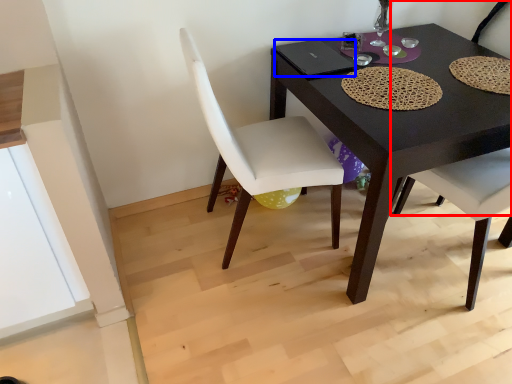
Question: Which point is further to the camera, chair (highlighted by a red box) or laptop (highlighted by a blue box)?

Choices:
 (A) chair
 (B) laptop

Answer: (B)